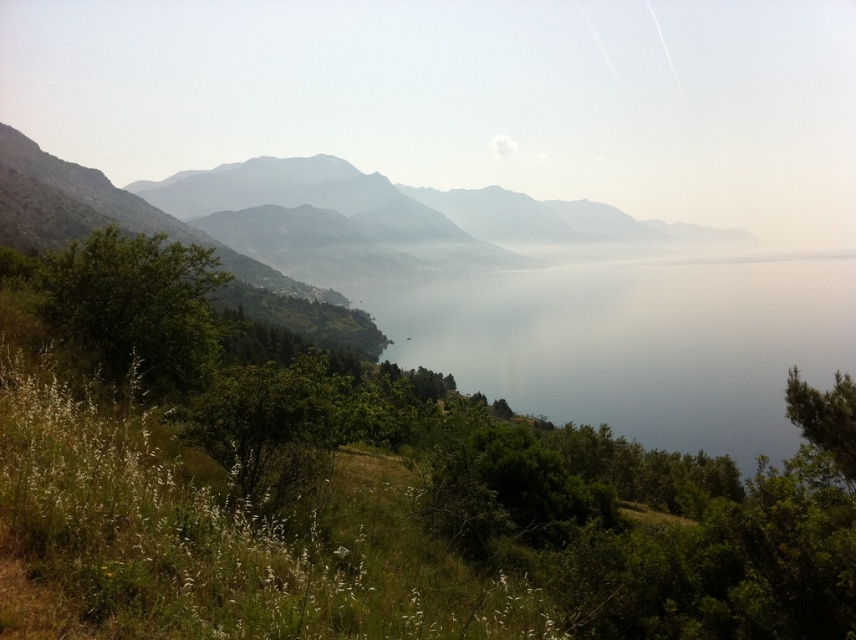
You are standing on the grassy hillside in the foreground and want to walk to the shoreline. Which direction should you head to avoid the green leafy tree at left and the green leafy tree at lower right?

To avoid both the green leafy tree at left and the green leafy tree at lower right, you should head directly towards the shoreline while moving towards the center between them, as the green leafy tree at left is positioned to the left of the green leafy tree at lower right.

You are a hiker who wants to cross the lake using a small boat. The boat you have can only carry you and one item. You need to decide whether to take a fishing rod or a map. To make this decision, you need to know the distance between the transparent water at center and the green leafy tree at left. Which item should you choose, and why?

The distance between the transparent water at center and the green leafy tree at left is 1088.64 feet. Since the boat can only carry you and one item, you should take the map because the distance is too far to navigate without it, and the fishing rod would be unnecessary for crossing such a large expanse of water.